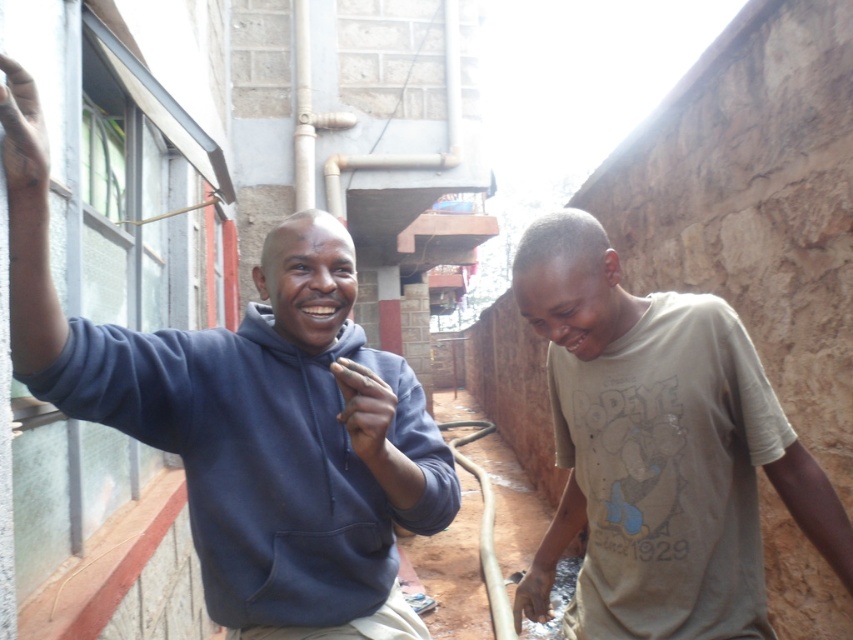
You are standing in the alleyway and want to hand a small note to the person wearing the dark blue hoodie at left. Since you can only reach up to shoulder height, will you be able to reach them if the light brown cotton shirt at lower right is blocking your path?

The dark blue hoodie at left is located above the light brown cotton shirt at lower right, so if the light brown cotton shirt at lower right is blocking your path, you may need to move around them to reach the dark blue hoodie at left at shoulder height.

You are standing in an alleyway with two points marked. The first point is at coordinates point (380, 540) and the second is at point (590, 548). Which point is closer to you?

Point (380, 540) is closer to the viewer than point (590, 548).